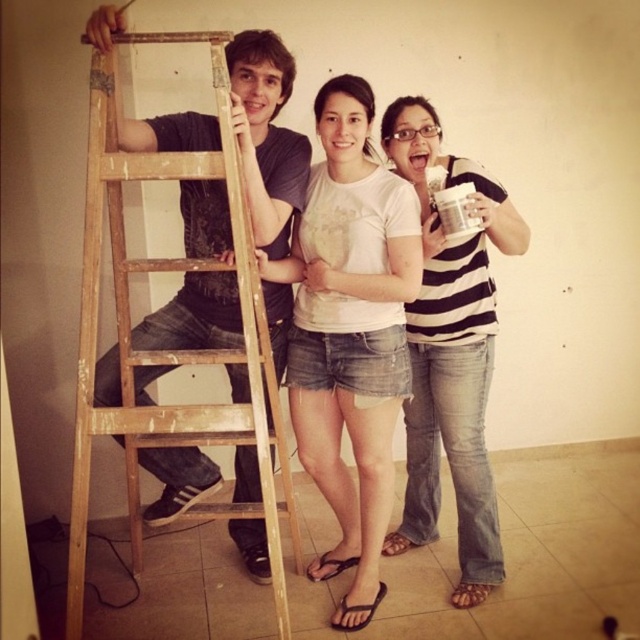
Between white matte t-shirt at center and striped cotton shirt at center, which one is positioned lower?

white matte t-shirt at center is below.

Between point (394, 348) and point (422, 310), which one is positioned in front?

Positioned in front is point (394, 348).

You are a GUI agent. You are given a task and a screenshot of the screen. Output one action in this format:
    pyautogui.click(x=<x>, y=<y>)
    Task: Click on the white matte t-shirt at center
    The height and width of the screenshot is (640, 640).
    Given the screenshot: What is the action you would take?
    pyautogui.click(x=349, y=333)

You are a GUI agent. You are given a task and a screenshot of the screen. Output one action in this format:
    pyautogui.click(x=<x>, y=<y>)
    Task: Click on the white matte t-shirt at center
    
    Given the screenshot: What is the action you would take?
    pyautogui.click(x=349, y=333)

Which is more to the left, white matte t-shirt at center or wooden ladder at left?

wooden ladder at left is more to the left.

Describe the element at coordinates (349, 333) in the screenshot. This screenshot has height=640, width=640. I see `white matte t-shirt at center` at that location.

Find the location of `white matte t-shirt at center`. white matte t-shirt at center is located at coordinates (349, 333).

Does wooden ladder at left have a lesser height compared to striped cotton shirt at center?

Correct, wooden ladder at left is not as tall as striped cotton shirt at center.

Does wooden ladder at left have a lesser width compared to striped cotton shirt at center?

No, wooden ladder at left is not thinner than striped cotton shirt at center.

Between point (77, 444) and point (404, 157), which one is positioned in front?

Point (77, 444) is more forward.

Where is `wooden ladder at left`? wooden ladder at left is located at coordinates [x=172, y=349].